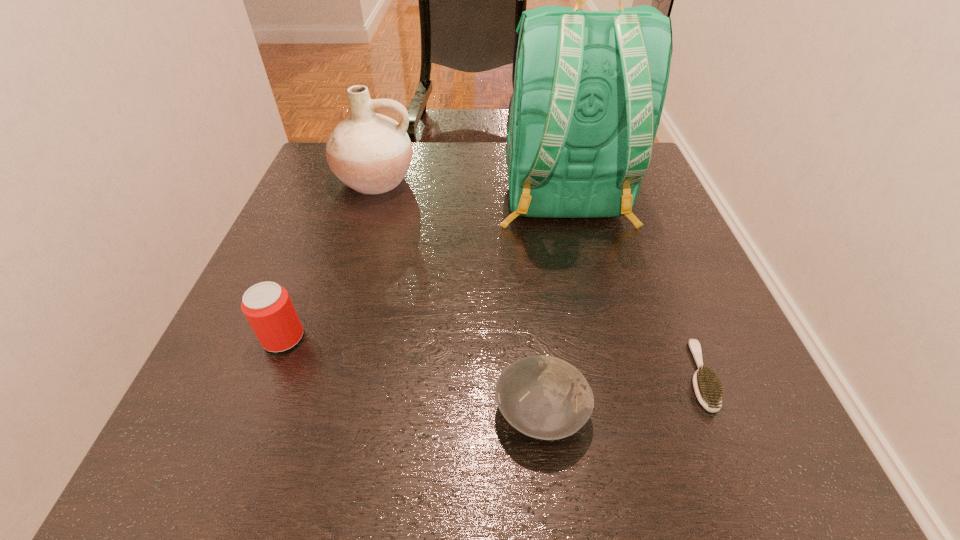
The image size is (960, 540). I want to click on backpack at the far edge, so click(589, 87).

Find the location of a particular element. The image size is (960, 540). pottery located in the far edge section of the desktop is located at coordinates (371, 153).

Where is `object that is at the near edge`? The height and width of the screenshot is (540, 960). object that is at the near edge is located at coordinates (544, 397).

The image size is (960, 540). I want to click on pottery located at the left edge, so click(x=371, y=153).

Find the location of `beer can that is at the left edge`. beer can that is at the left edge is located at coordinates (267, 306).

Locate an element on the screen. Image resolution: width=960 pixels, height=540 pixels. backpack located in the right edge section of the desktop is located at coordinates (589, 87).

Where is `scrubbing brush located at the right edge`? This screenshot has height=540, width=960. scrubbing brush located at the right edge is located at coordinates (708, 389).

What are the coordinates of `object at the far left corner` in the screenshot? It's located at (371, 153).

Locate an element on the screen. object located at the far right corner is located at coordinates (589, 87).

Identify the location of free space at the far edge of the desktop. (471, 179).